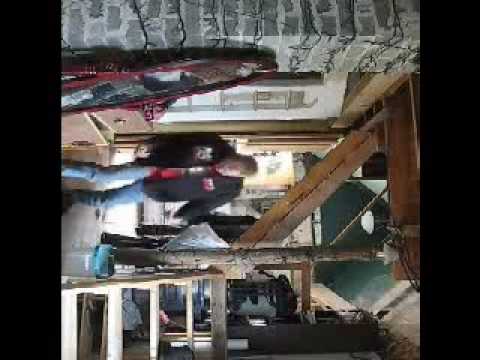
Identify the location of trash. This screenshot has height=360, width=480. (100, 272).